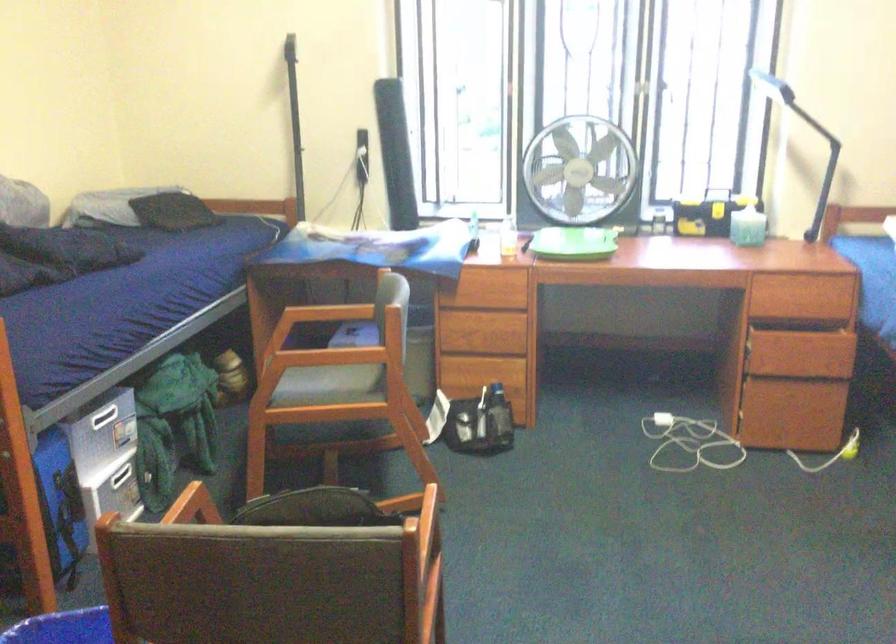
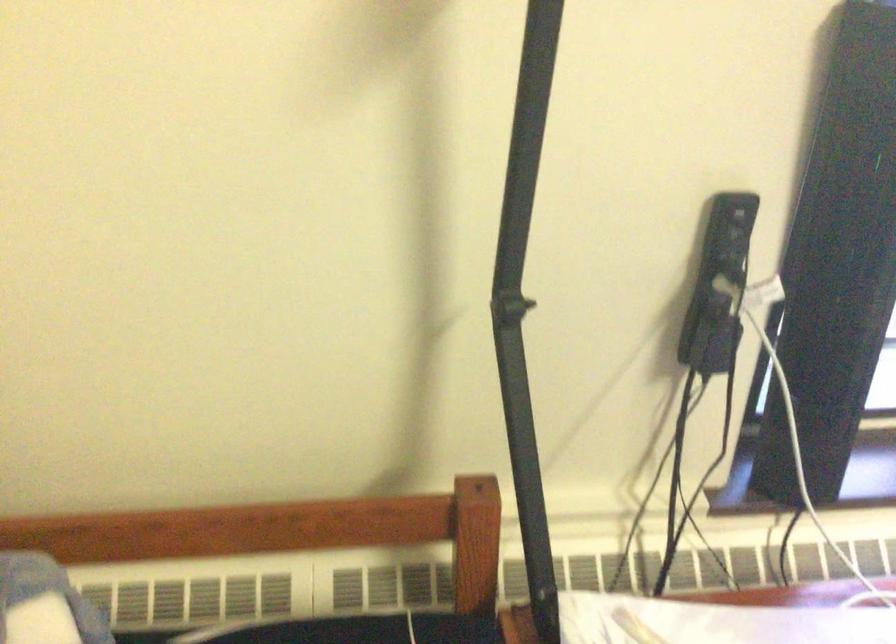
Where in the second image is the point corresponding to pixel 306 138 from the first image?

(524, 305)